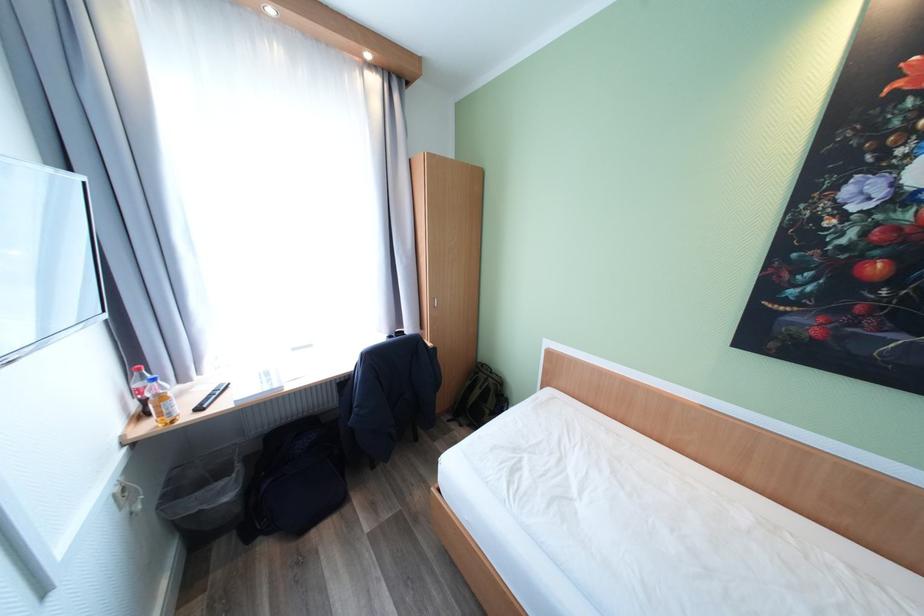
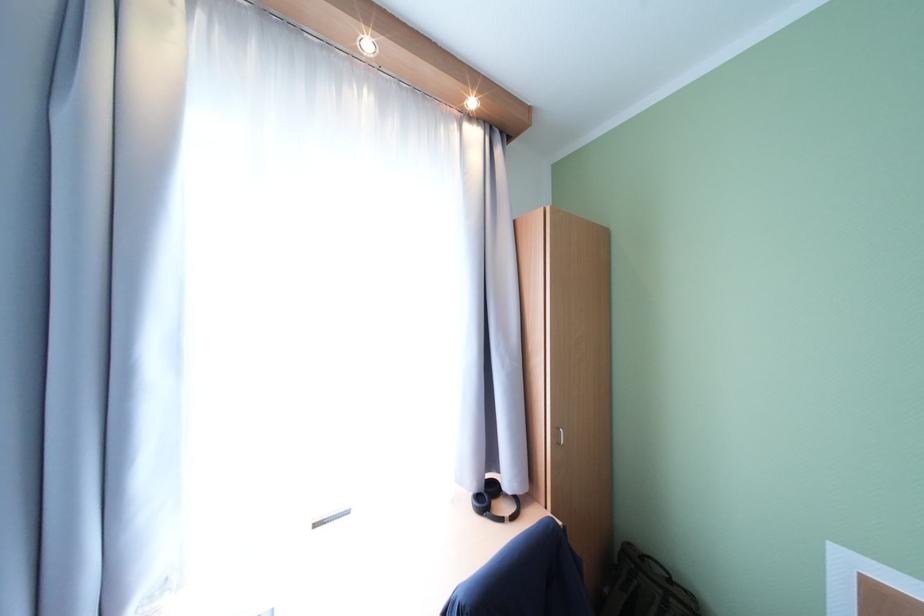
In a continuous first-person perspective shot, in which direction is the camera moving?

The cameraman walked toward left, forward.